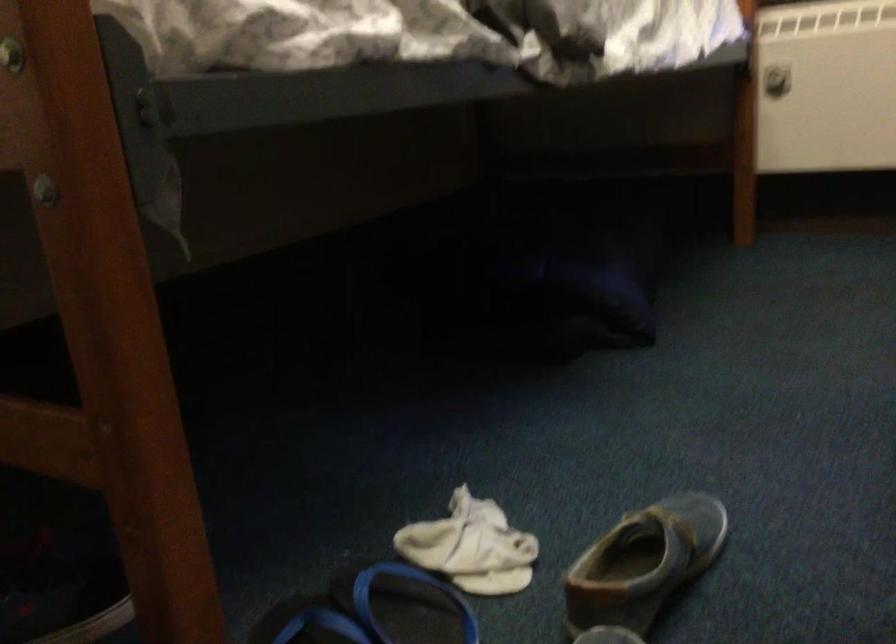
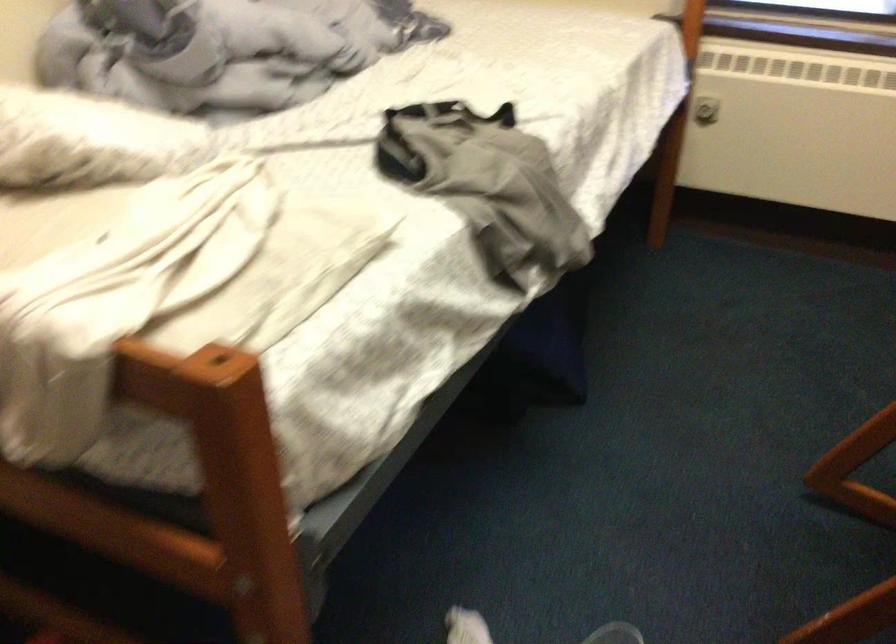
In a continuous first-person perspective shot, in which direction is the camera moving?

The cameraman moved toward left, backward.